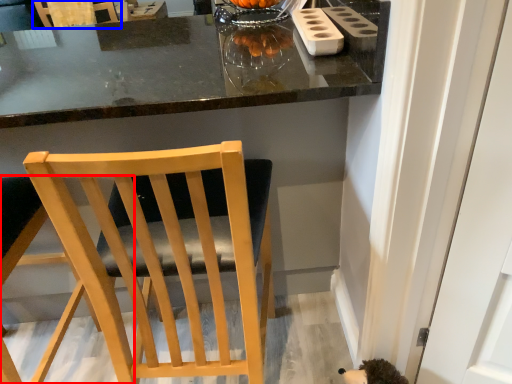
Question: Which of the following is the farthest to the observer, chair (highlighted by a red box) or chair (highlighted by a blue box)?

Choices:
 (A) chair
 (B) chair

Answer: (B)